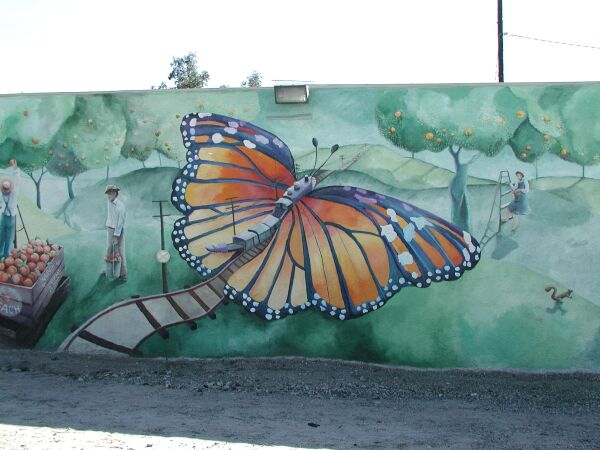
I want to click on ladder, so click(501, 195).